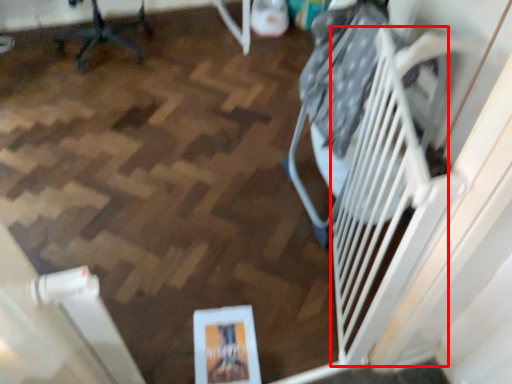
Question: In this image, where is stairs (annotated by the red box) located relative to furniture?

Choices:
 (A) right
 (B) left

Answer: (A)